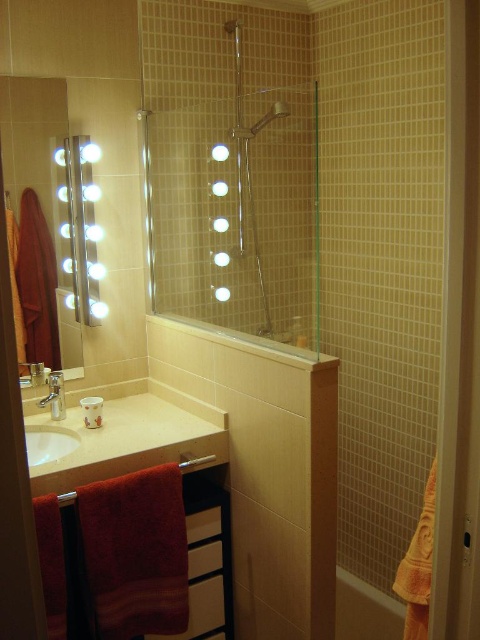
Question: Does white glossy bath at lower right have a greater width compared to white glossy sink at lower left?

Choices:
 (A) no
 (B) yes

Answer: (B)

Question: Is matte black mirror at left above brushed metal faucet at sink left?

Choices:
 (A) no
 (B) yes

Answer: (B)

Question: Which object appears closest to the camera in this image?

Choices:
 (A) white glossy sink at lower left
 (B) brushed metal faucet at sink left

Answer: (A)

Question: Which of the following is the farthest from the observer?

Choices:
 (A) brushed metal faucet at sink left
 (B) white glossy sink at lower left
 (C) matte black mirror at left

Answer: (A)

Question: Which object appears closest to the camera in this image?

Choices:
 (A) red fabric towel bar at lower left
 (B) brushed metal faucet at sink left
 (C) matte black mirror at left
 (D) transparent glass shower door at upper center

Answer: (C)

Question: Is transparent glass shower door at upper center closer to the viewer compared to white glossy bath at lower right?

Choices:
 (A) no
 (B) yes

Answer: (B)